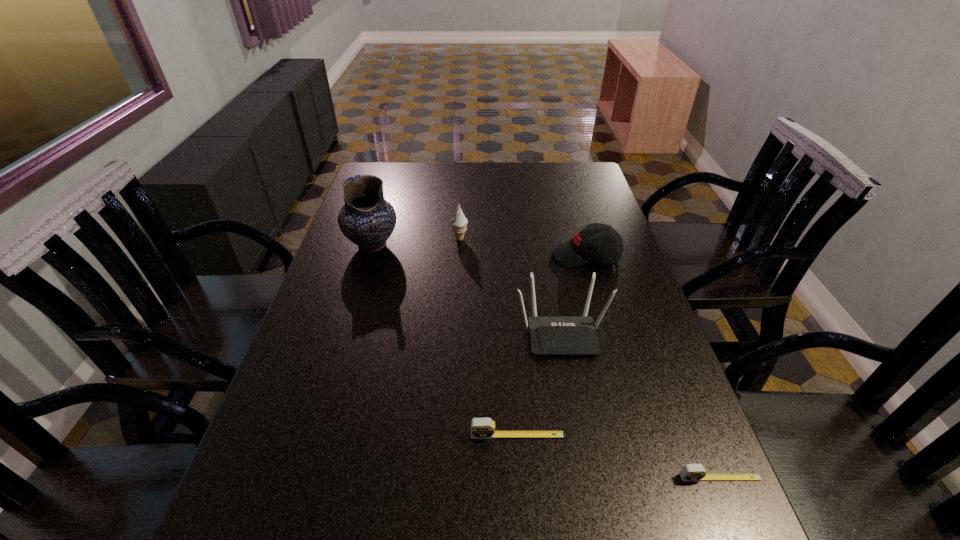
Image resolution: width=960 pixels, height=540 pixels. Identify the location of router at the right edge. (548, 335).

In order to click on object that is at the near right corner in this screenshot , I will do `click(690, 472)`.

I want to click on vacant region at the far edge of the desktop, so click(x=511, y=178).

In the image, there is a desktop. At what (x,y) coordinates should I click in order to perform the action: click on blank space at the near edge. Please return your answer as a coordinate pair (x, y). Image resolution: width=960 pixels, height=540 pixels. Looking at the image, I should click on (355, 510).

At what (x,y) coordinates should I click in order to perform the action: click on free space at the right edge of the desktop. Please return your answer as a coordinate pair (x, y). Looking at the image, I should click on (596, 316).

In the image, there is a desktop. At what (x,y) coordinates should I click in order to perform the action: click on free space at the far right corner. Please return your answer as a coordinate pair (x, y). The image size is (960, 540). Looking at the image, I should click on (602, 193).

You are a GUI agent. You are given a task and a screenshot of the screen. Output one action in this format:
    pyautogui.click(x=<x>, y=<y>)
    Task: Click on the free space at the near right corner of the desktop
    
    Given the screenshot: What is the action you would take?
    pyautogui.click(x=645, y=487)

Where is `empty space that is in between the fourth tallest object and the router`? This screenshot has height=540, width=960. empty space that is in between the fourth tallest object and the router is located at coordinates (574, 294).

Find the location of a particular element. Image resolution: width=960 pixels, height=540 pixels. free space between the shorter tape measure and the router is located at coordinates (640, 406).

In order to click on vacant area between the router and the left tape measure in this screenshot , I will do `click(540, 384)`.